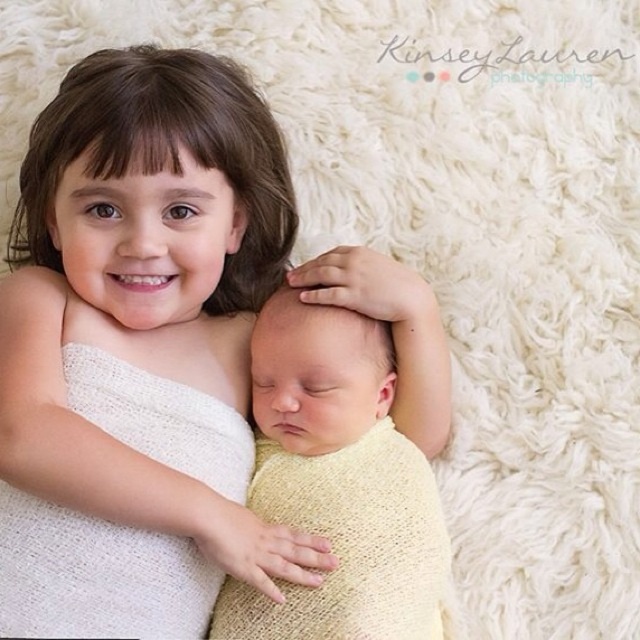
Question: Can you confirm if white knitted fabric at upper left is wider than yellow knitted fabric at center?

Choices:
 (A) yes
 (B) no

Answer: (A)

Question: Which of the following is the farthest from the observer?

Choices:
 (A) [x=333, y=380]
 (B) [x=56, y=221]

Answer: (B)

Question: Which point appears closest to the camera in this image?

Choices:
 (A) (266, 589)
 (B) (324, 518)

Answer: (A)

Question: Which object appears farthest from the camera in this image?

Choices:
 (A) white knitted fabric at upper left
 (B) yellow knitted fabric at center

Answer: (B)

Question: From the image, what is the correct spatial relationship of white knitted fabric at upper left in relation to yellow knitted fabric at center?

Choices:
 (A) above
 (B) below

Answer: (A)

Question: Where is white knitted fabric at upper left located in relation to yellow knitted fabric at center in the image?

Choices:
 (A) above
 (B) below

Answer: (A)